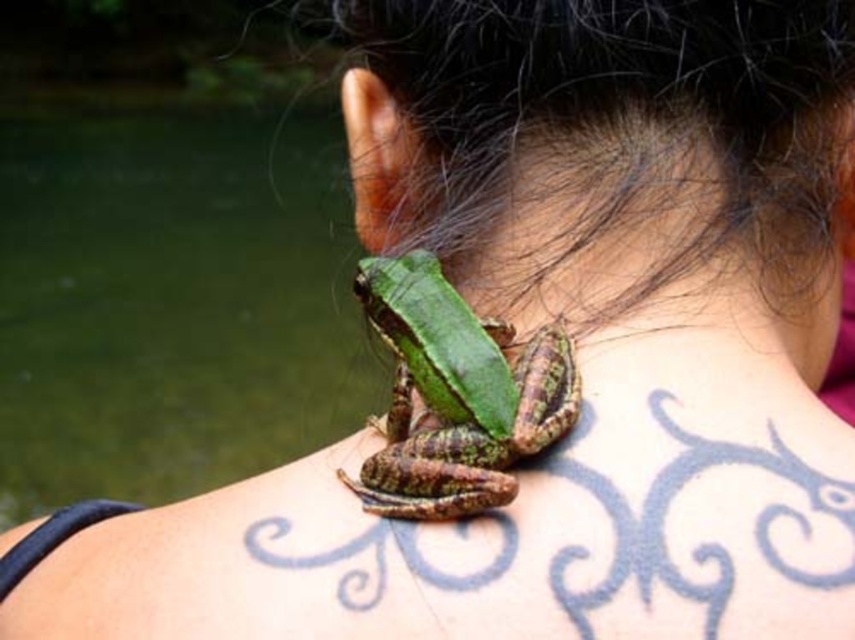
Question: Does green matte skin at center have a greater width compared to green rough skin frog at center?

Choices:
 (A) yes
 (B) no

Answer: (A)

Question: In this image, where is green matte skin at center located relative to green rough skin frog at center?

Choices:
 (A) left
 (B) right

Answer: (B)

Question: Which point is closer to the camera?

Choices:
 (A) (770, 216)
 (B) (435, 294)

Answer: (B)

Question: Observing the image, what is the correct spatial positioning of green matte skin at center in reference to green rough skin frog at center?

Choices:
 (A) above
 (B) below

Answer: (A)